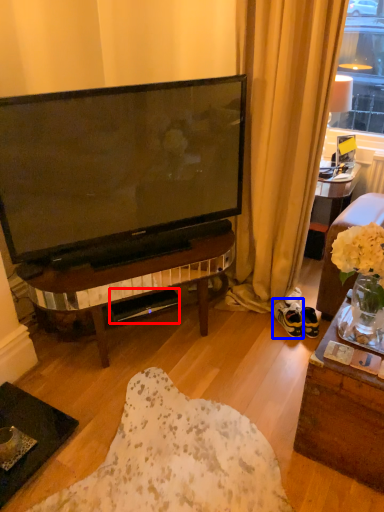
Question: Which of the following is the closest to the observer, loudspeaker (highlighted by a red box) or footwear (highlighted by a blue box)?

Choices:
 (A) loudspeaker
 (B) footwear

Answer: (A)